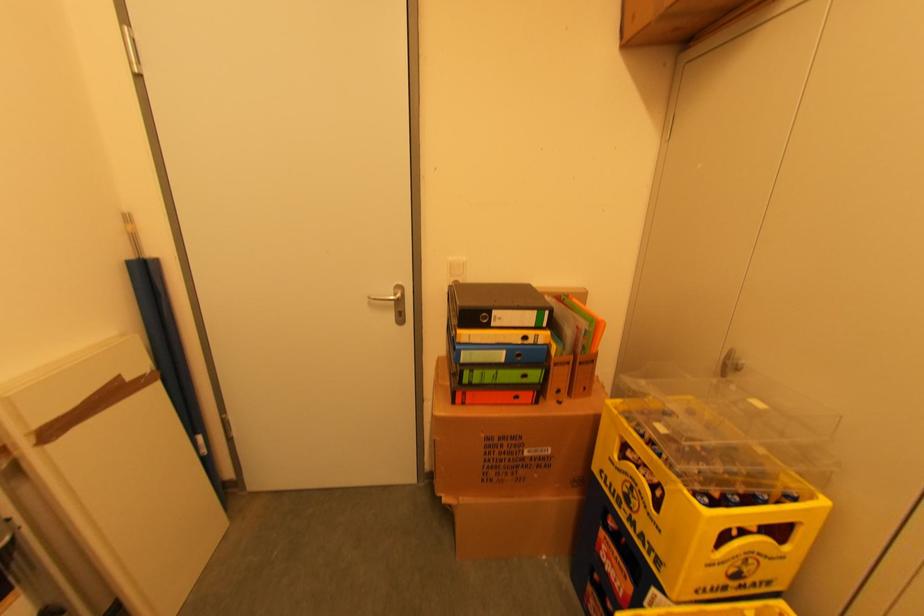
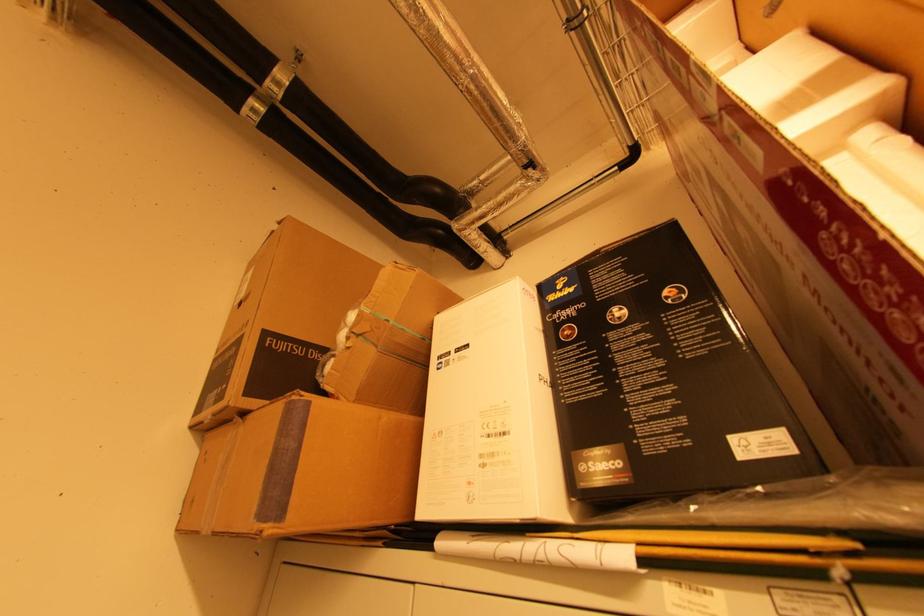
The images are taken continuously from a first-person perspective. In which direction is your viewpoint rotating?

The camera rotated toward right-up.